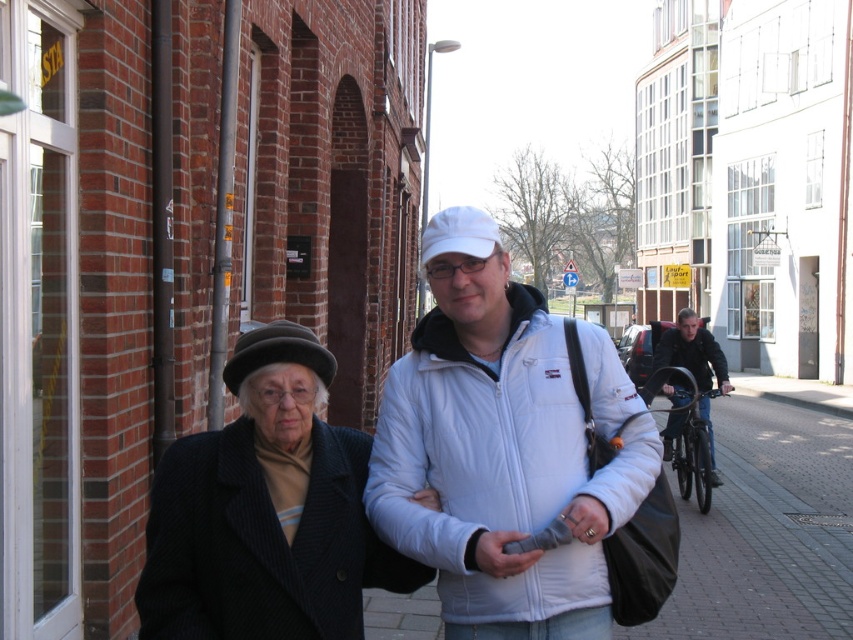
Question: Which point is closer to the camera taking this photo?

Choices:
 (A) (793, 637)
 (B) (718, 352)
 (C) (277, 346)

Answer: (C)

Question: Is dark brown felt baseball hat at center above matte black phone at center?

Choices:
 (A) no
 (B) yes

Answer: (B)

Question: Is the position of white fabric jacket at center less distant than that of dark blue jacket at right?

Choices:
 (A) yes
 (B) no

Answer: (A)

Question: Is dark wool coat at center smaller than matte black phone at center?

Choices:
 (A) no
 (B) yes

Answer: (A)

Question: Among these points, which one is nearest to the camera?

Choices:
 (A) (440, 355)
 (B) (677, 320)
 (C) (822, 481)
 (D) (312, 369)

Answer: (D)

Question: Which object is farther from the camera taking this photo?

Choices:
 (A) dark blue jacket at right
 (B) white fabric jacket at center

Answer: (A)